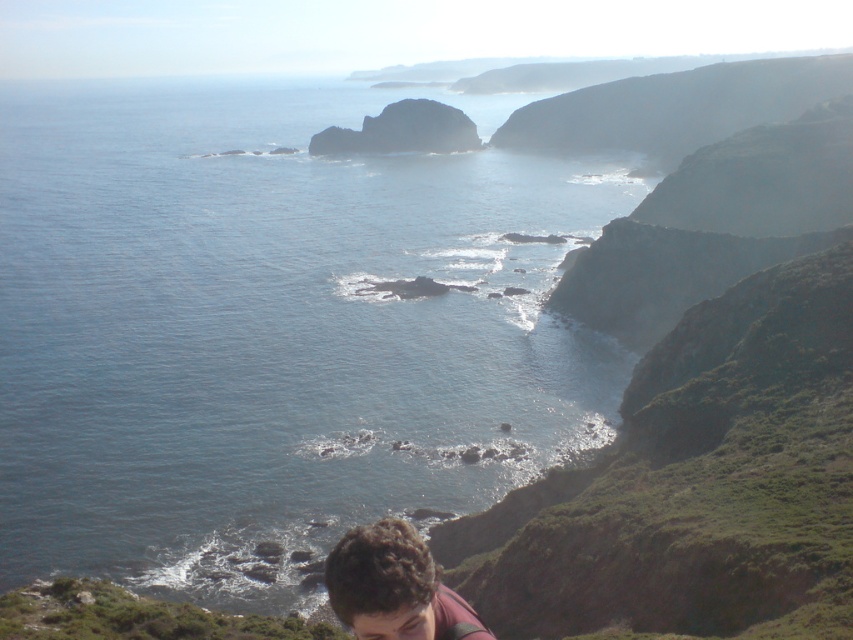
You are a photographer planning to capture the blue water at center and the brown curly hair at lower center in a single shot. Based on their sizes in the image, which one would you focus on first to ensure clarity?

The blue water at center is bigger than the brown curly hair at lower center, so focusing on the blue water at center first would ensure clarity due to its larger size in the frame.

You are standing at the cliff edge in the coastal landscape and see two points marked in the image. Which point is closer to you, point (607, 428) or point (469, 618)?

Point (607, 428) is further to the viewer than point (469, 618), so the closer point to you is point (469, 618).